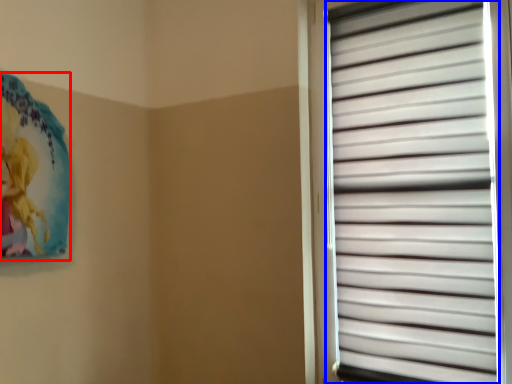
Question: Which object is further to the camera taking this photo, art (highlighted by a red box) or window blind (highlighted by a blue box)?

Choices:
 (A) art
 (B) window blind

Answer: (A)